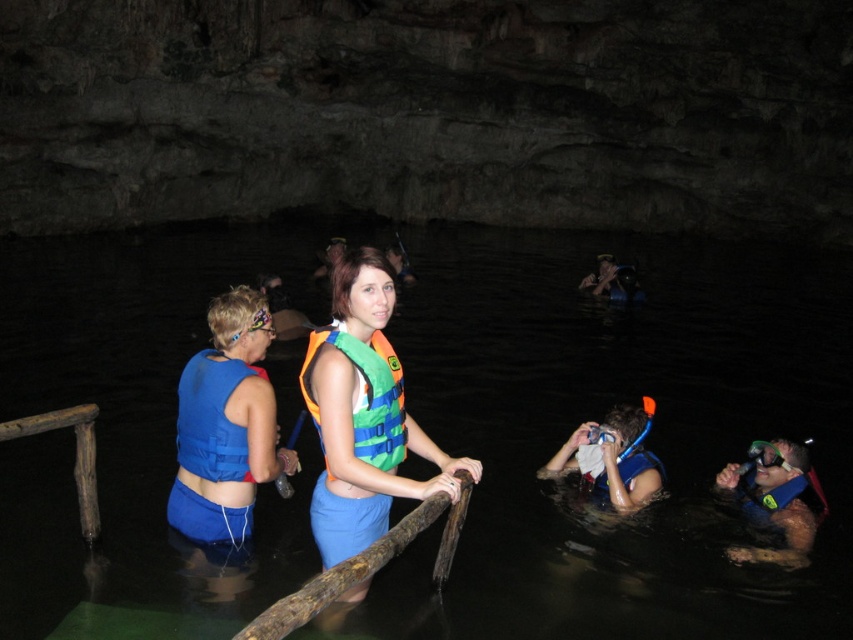
You are a photographer positioned at the center of the cave. You want to take a photo of two points marked in the image. The first point is point (332, 292) and the second point is point (309, 412). Which point should you focus on first to ensure it appears clearer in the photo?

Point (332, 292) is closer to the viewer than point (309, 412), so you should focus on point (332, 292) first to ensure it appears clearer in the photo.